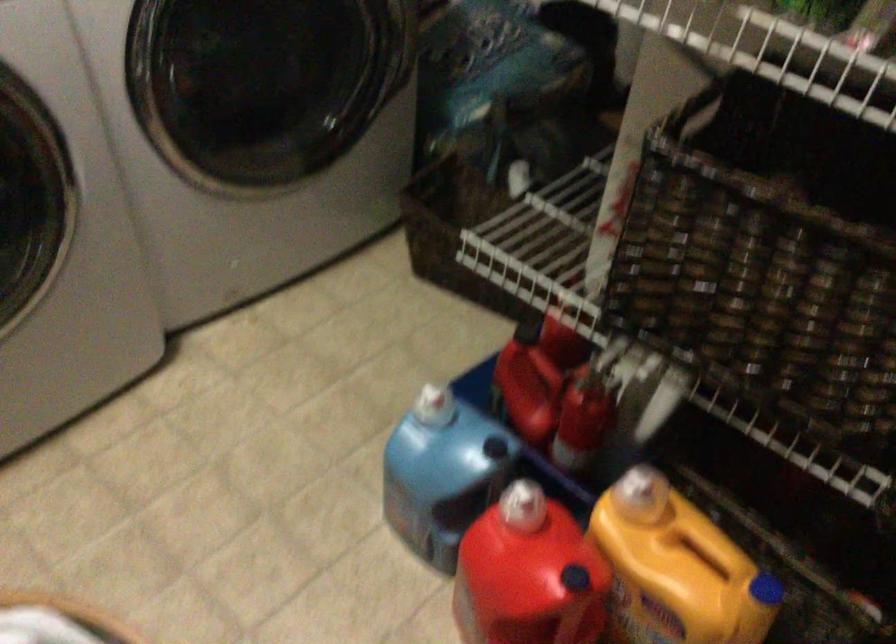
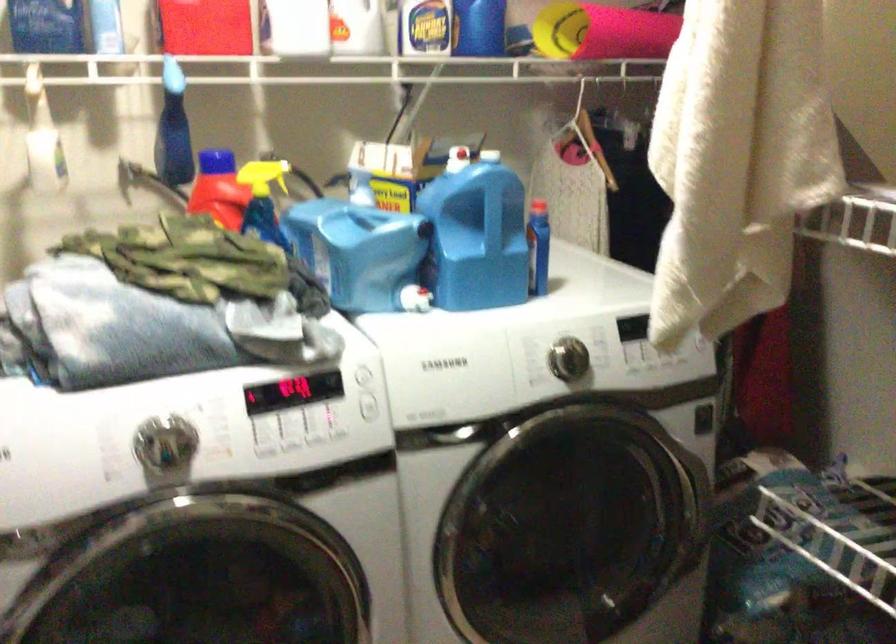
The first image is from the beginning of the video and the second image is from the end. How did the camera likely rotate when shooting the video?

The rotation direction of the camera is left-up.